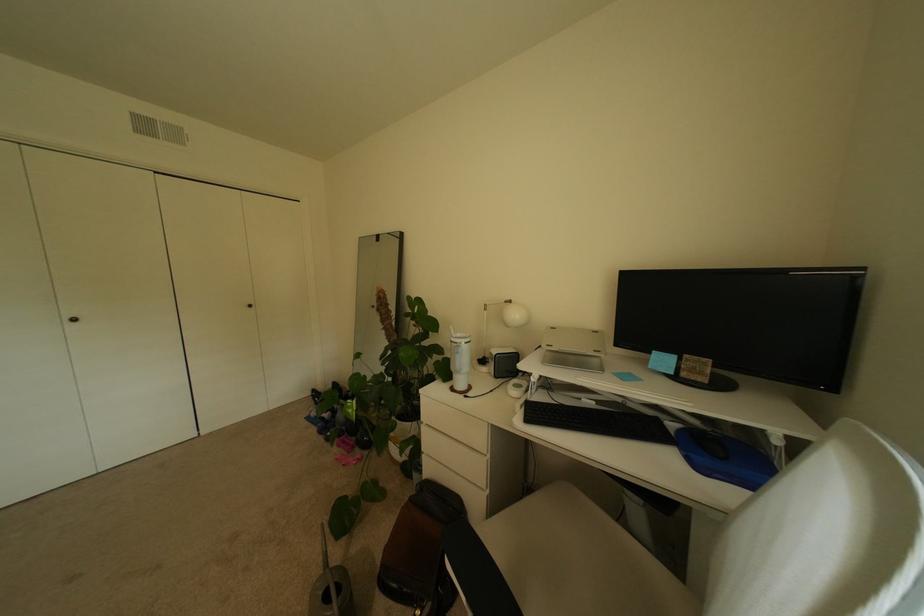
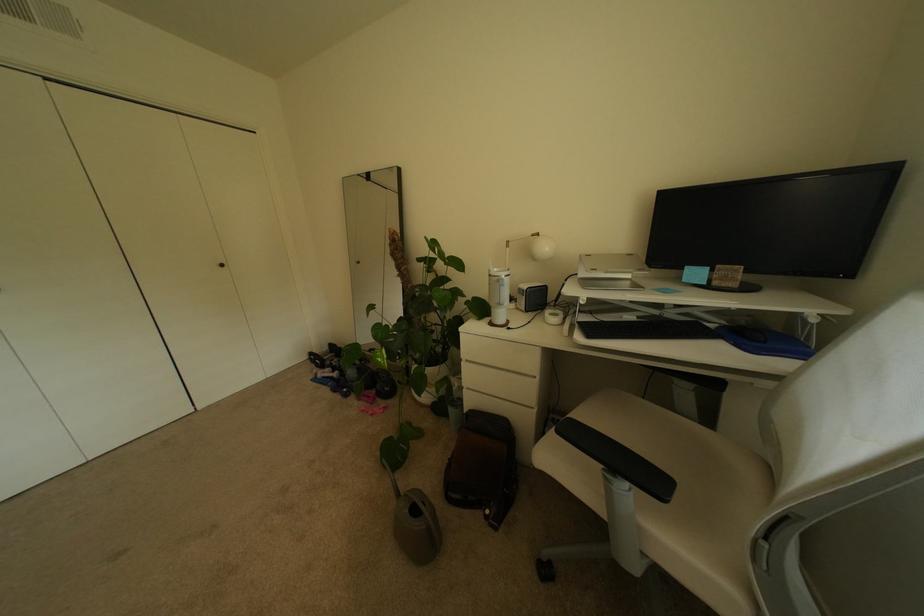
In the second image, find the point that corresponds to point (499, 354) in the first image.

(528, 290)